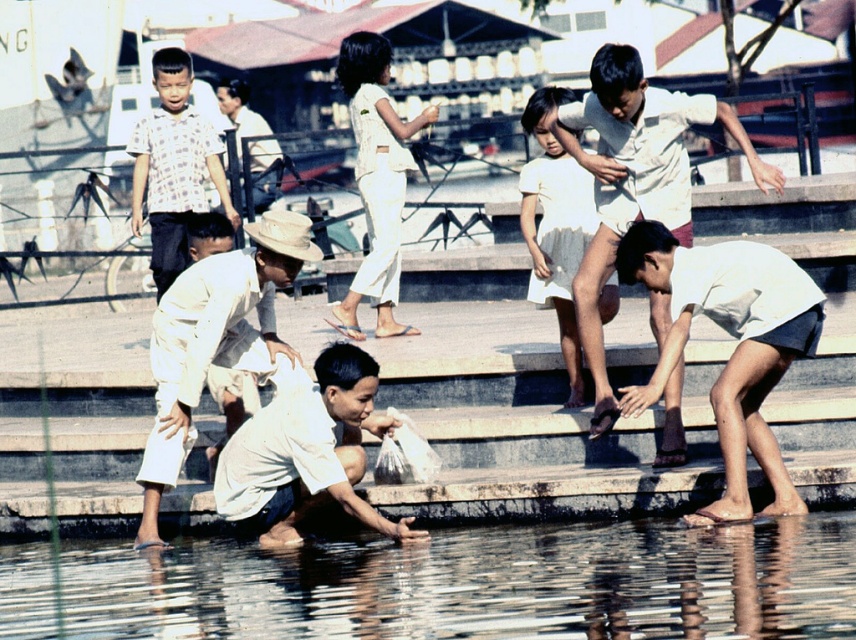
Question: Which object is the farthest from the white cotton dress at center?

Choices:
 (A) white matte shirt at lower center
 (B) white cotton shirt at lower right

Answer: (A)

Question: Which of the following is the closest to the observer?

Choices:
 (A) (764, 184)
 (B) (694, 634)

Answer: (B)

Question: Based on their relative distances, which object is nearer to the clear water at lower center?

Choices:
 (A) printed cotton shirt at left
 (B) white cotton shirt at center
 (C) white cotton pants at center
 (D) white cotton shirt at lower right

Answer: (A)

Question: Can you confirm if clear water at lower center is smaller than printed cotton shirt at left?

Choices:
 (A) yes
 (B) no

Answer: (A)

Question: Is printed cotton shirt at left bigger than white cotton dress at center?

Choices:
 (A) no
 (B) yes

Answer: (B)

Question: Is white cotton shirt at center positioned behind white cotton shirt at lower center?

Choices:
 (A) yes
 (B) no

Answer: (B)